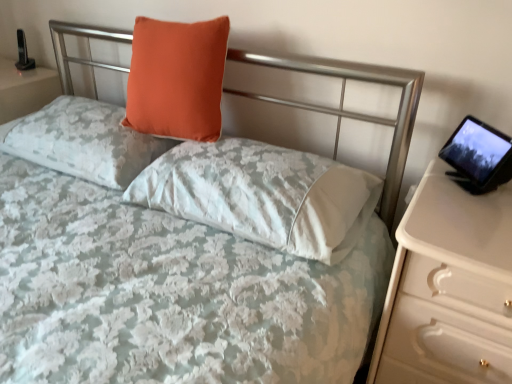
Question: From the image's perspective, does orange velvet pillow at upper center, which is the 2th pillow from right to left, appear higher than matte orange pillow at upper left, which ranks as the 3th pillow in right-to-left order?

Choices:
 (A) no
 (B) yes

Answer: (B)

Question: Does orange velvet pillow at upper center, which is the 2th pillow from right to left, lie in front of matte orange pillow at upper left, placed as the first pillow when sorted from left to right?

Choices:
 (A) yes
 (B) no

Answer: (A)

Question: Considering the relative sizes of orange velvet pillow at upper center, which is the 2th pillow from right to left, and matte orange pillow at upper left, placed as the first pillow when sorted from left to right, in the image provided, is orange velvet pillow at upper center, which is the 2th pillow from right to left, taller than matte orange pillow at upper left, placed as the first pillow when sorted from left to right,?

Choices:
 (A) no
 (B) yes

Answer: (B)

Question: Would you consider orange velvet pillow at upper center, which is the 2th pillow from right to left, to be distant from matte orange pillow at upper left, placed as the first pillow when sorted from left to right?

Choices:
 (A) no
 (B) yes

Answer: (A)

Question: Could matte orange pillow at upper left, which ranks as the 3th pillow in right-to-left order, be considered to be inside orange velvet pillow at upper center, which is the 2th pillow from right to left?

Choices:
 (A) yes
 (B) no

Answer: (B)

Question: Choose the correct answer: Is orange fabric pillow at upper center, the 3th pillow when ordered from left to right, inside white glossy nightstand at right or outside it?

Choices:
 (A) inside
 (B) outside

Answer: (B)

Question: Considering the positions of orange fabric pillow at upper center, the 3th pillow when ordered from left to right, and white glossy nightstand at right in the image, is orange fabric pillow at upper center, the 3th pillow when ordered from left to right, taller or shorter than white glossy nightstand at right?

Choices:
 (A) short
 (B) tall

Answer: (A)

Question: From the image's perspective, is orange fabric pillow at upper center, the 3th pillow when ordered from left to right, above or below white glossy nightstand at right?

Choices:
 (A) above
 (B) below

Answer: (A)

Question: Looking at the image, does orange fabric pillow at upper center, the 3th pillow when ordered from left to right, seem bigger or smaller compared to white glossy nightstand at right?

Choices:
 (A) small
 (B) big

Answer: (A)

Question: From a real-world perspective, is matte orange pillow at upper left, which ranks as the 3th pillow in right-to-left order, above or below orange velvet pillow at upper center, the second pillow in the left-to-right sequence?

Choices:
 (A) above
 (B) below

Answer: (B)

Question: Is matte orange pillow at upper left, placed as the first pillow when sorted from left to right, spatially inside orange velvet pillow at upper center, which is the 2th pillow from right to left, or outside of it?

Choices:
 (A) outside
 (B) inside

Answer: (A)

Question: Considering the relative positions of matte orange pillow at upper left, which ranks as the 3th pillow in right-to-left order, and orange velvet pillow at upper center, the second pillow in the left-to-right sequence, in the image provided, is matte orange pillow at upper left, which ranks as the 3th pillow in right-to-left order, to the left or to the right of orange velvet pillow at upper center, the second pillow in the left-to-right sequence,?

Choices:
 (A) left
 (B) right

Answer: (A)

Question: Based on their sizes in the image, would you say matte orange pillow at upper left, placed as the first pillow when sorted from left to right, is bigger or smaller than orange velvet pillow at upper center, the second pillow in the left-to-right sequence?

Choices:
 (A) big
 (B) small

Answer: (A)

Question: From a real-world perspective, is white glossy nightstand at right positioned above or below matte orange pillow at upper left, which ranks as the 3th pillow in right-to-left order?

Choices:
 (A) above
 (B) below

Answer: (B)

Question: Is point (467, 193) closer or farther from the camera than point (77, 132)?

Choices:
 (A) farther
 (B) closer

Answer: (B)